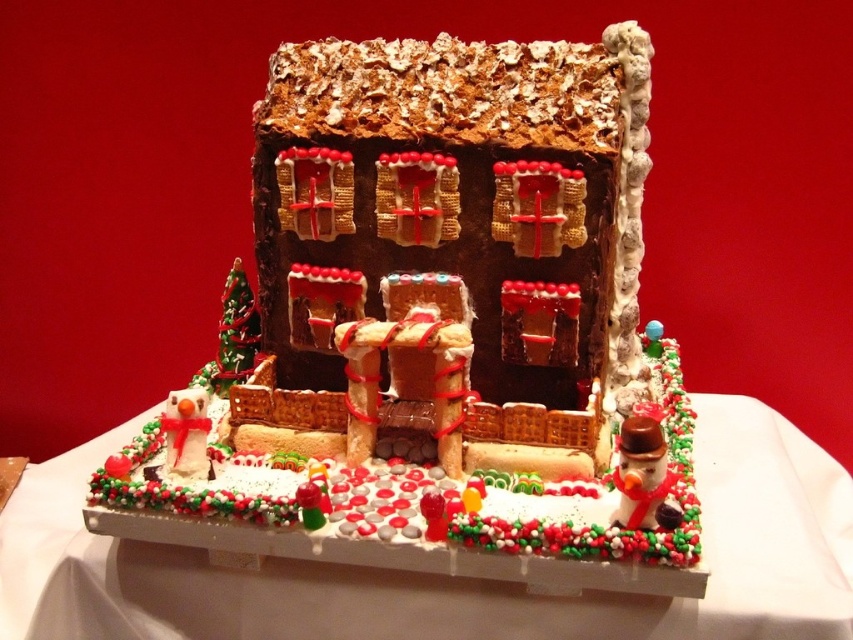
Question: Which point is closer to the camera taking this photo?

Choices:
 (A) (740, 468)
 (B) (357, 326)

Answer: (B)

Question: From the image, what is the correct spatial relationship of chocolate gingerbread house at center in relation to white frosted cake at center?

Choices:
 (A) below
 (B) above

Answer: (B)

Question: Which of the following is the farthest from the observer?

Choices:
 (A) (86, 618)
 (B) (637, 253)

Answer: (B)

Question: From the image, what is the correct spatial relationship of chocolate gingerbread house at center in relation to white frosted cake at center?

Choices:
 (A) left
 (B) right

Answer: (B)

Question: Is chocolate gingerbread house at center smaller than white frosted cake at center?

Choices:
 (A) yes
 (B) no

Answer: (B)